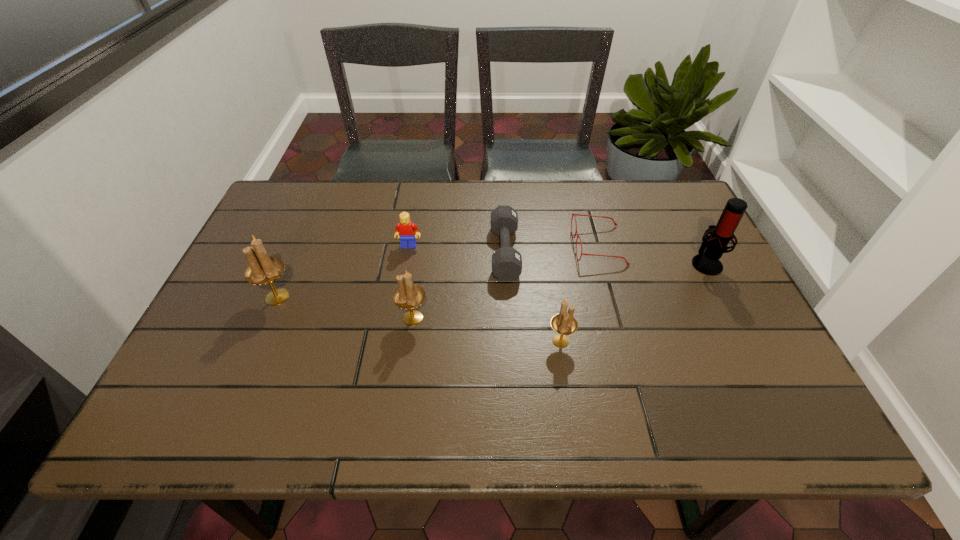
Find the location of a particular element. the second shortest object is located at coordinates (506, 261).

This screenshot has width=960, height=540. What are the coordinates of `Lego` in the screenshot? It's located at (405, 229).

Locate an element on the screen. vacant region located 0.220m on the right of the leftmost object is located at coordinates (384, 297).

Image resolution: width=960 pixels, height=540 pixels. In order to click on vacant space situated on the left of the second candle holder from right to left in this screenshot , I will do `click(338, 318)`.

Where is `free space located on the front of the rightmost candle holder`? Image resolution: width=960 pixels, height=540 pixels. free space located on the front of the rightmost candle holder is located at coordinates (566, 380).

This screenshot has height=540, width=960. Find the location of `blank space located on the face of the shortest object`. blank space located on the face of the shortest object is located at coordinates (444, 246).

Locate an element on the screen. free point located 0.350m on the face of the shortest object is located at coordinates (448, 246).

This screenshot has width=960, height=540. I want to click on free space located on the face of the shortest object, so click(x=463, y=246).

At what (x,y) coordinates should I click in order to perform the action: click on free region located on the back of the microphone. Please return your answer as a coordinate pair (x, y). Image resolution: width=960 pixels, height=540 pixels. Looking at the image, I should click on (675, 202).

Where is `blank space located on the left of the fourth object from right to left`? The height and width of the screenshot is (540, 960). blank space located on the left of the fourth object from right to left is located at coordinates (346, 252).